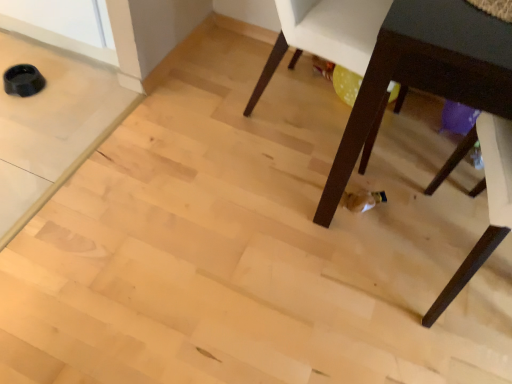
I want to click on free region on the left part of dark wood chair at lower right, acting as the 1th chair starting from the bottom, so click(351, 265).